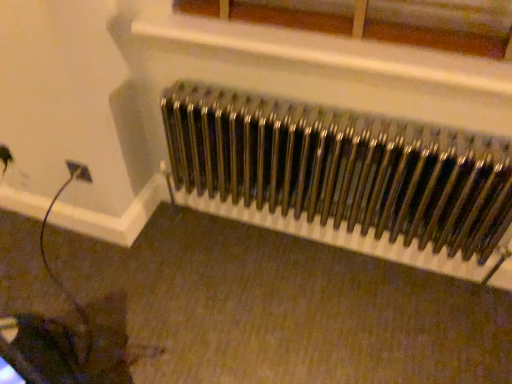
In order to face metallic white radiator at upper center, should I rotate leftwards or rightwards?

A 6.346 degree turn to the right will do.

Where is `metallic white radiator at upper center`? The image size is (512, 384). metallic white radiator at upper center is located at coordinates (442, 25).

The width and height of the screenshot is (512, 384). What do you see at coordinates (442, 25) in the screenshot? I see `metallic white radiator at upper center` at bounding box center [442, 25].

The image size is (512, 384). Describe the element at coordinates (342, 168) in the screenshot. I see `metallic radiator at center` at that location.

The width and height of the screenshot is (512, 384). Identify the location of metallic radiator at center. [x=342, y=168].

Locate an element on the screen. This screenshot has height=384, width=512. metallic white radiator at upper center is located at coordinates (442, 25).

Which is more to the right, metallic white radiator at upper center or metallic radiator at center?

From the viewer's perspective, metallic radiator at center appears more on the right side.

Is metallic white radiator at upper center in front of or behind metallic radiator at center in the image?

In the image, metallic white radiator at upper center appears in front of metallic radiator at center.

Which is in front, point (411, 25) or point (339, 187)?

The point (411, 25) is more forward.

From the image's perspective, is metallic white radiator at upper center over metallic radiator at center?

Yes.

From a real-world perspective, is metallic white radiator at upper center on top of metallic radiator at center?

Yes, from a real-world perspective, metallic white radiator at upper center is over metallic radiator at center

Considering the sizes of objects metallic white radiator at upper center and metallic radiator at center in the image provided, who is thinner, metallic white radiator at upper center or metallic radiator at center?

With smaller width is metallic white radiator at upper center.

Considering the sizes of metallic white radiator at upper center and metallic radiator at center in the image, is metallic white radiator at upper center taller or shorter than metallic radiator at center?

metallic white radiator at upper center is shorter than metallic radiator at center.

Can you confirm if metallic white radiator at upper center is bigger than metallic radiator at center?

No, metallic white radiator at upper center is not bigger than metallic radiator at center.

Is metallic white radiator at upper center inside the boundaries of metallic radiator at center, or outside?

metallic white radiator at upper center lies outside metallic radiator at center.

Looking at this image, are metallic white radiator at upper center and metallic radiator at center located far from each other?

metallic white radiator at upper center is actually quite close to metallic radiator at center.

Is metallic white radiator at upper center facing towards metallic radiator at center?

No, metallic white radiator at upper center is not turned towards metallic radiator at center.

From the picture: How many degrees apart are the facing directions of metallic white radiator at upper center and metallic radiator at center?

metallic white radiator at upper center and metallic radiator at center are facing 0.341 degrees away from each other.

Where is `window that is above the metallic radiator at center (from the image's perspective)`? The width and height of the screenshot is (512, 384). window that is above the metallic radiator at center (from the image's perspective) is located at coordinates (442, 25).

Considering the relative positions of metallic radiator at center and metallic white radiator at upper center in the image provided, is metallic radiator at center to the left of metallic white radiator at upper center from the viewer's perspective?

In fact, metallic radiator at center is to the right of metallic white radiator at upper center.

Between metallic radiator at center and metallic white radiator at upper center, which one is positioned in front?

metallic white radiator at upper center is more forward.

Is point (311, 191) positioned after point (489, 57)?

Yes, point (311, 191) is behind point (489, 57).

From the image's perspective, is metallic radiator at center above or below metallic white radiator at upper center?

Clearly, from the image's perspective, metallic radiator at center is below metallic white radiator at upper center.

From a real-world perspective, relative to metallic white radiator at upper center, is metallic radiator at center vertically above or below?

In terms of real-world spatial position, metallic radiator at center is below metallic white radiator at upper center.

Considering the sizes of objects metallic radiator at center and metallic white radiator at upper center in the image provided, who is thinner, metallic radiator at center or metallic white radiator at upper center?

metallic white radiator at upper center.

Is metallic radiator at center shorter than metallic white radiator at upper center?

In fact, metallic radiator at center may be taller than metallic white radiator at upper center.

Is metallic radiator at center bigger or smaller than metallic white radiator at upper center?

metallic radiator at center is bigger than metallic white radiator at upper center.

Is metallic radiator at center situated inside metallic white radiator at upper center or outside?

metallic radiator at center lies outside metallic white radiator at upper center.

Would you say metallic radiator at center is a long distance from metallic white radiator at upper center?

No, there isn't a large distance between metallic radiator at center and metallic white radiator at upper center.

Is metallic radiator at center facing towards metallic white radiator at upper center?

No, metallic radiator at center is not aimed at metallic white radiator at upper center.

What's the angular difference between metallic radiator at center and metallic white radiator at upper center's facing directions?

0.341 degrees.

This screenshot has width=512, height=384. Find the location of `window above the metallic radiator at center (from the image's perspective)`. window above the metallic radiator at center (from the image's perspective) is located at coordinates (442, 25).

This screenshot has height=384, width=512. Find the location of `window above the metallic radiator at center (from the image's perspective)`. window above the metallic radiator at center (from the image's perspective) is located at coordinates (442, 25).

Image resolution: width=512 pixels, height=384 pixels. Identify the location of radiator behind the metallic white radiator at upper center. (342, 168).